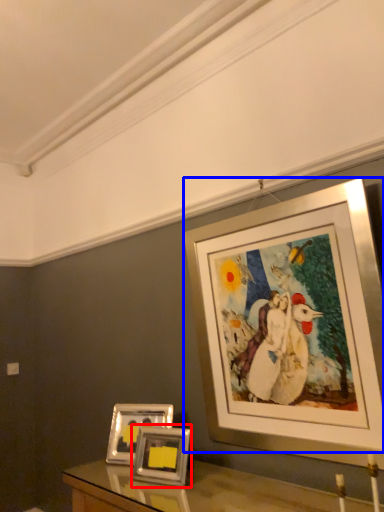
Question: Among these objects, which one is nearest to the camera, picture frame (highlighted by a red box) or picture frame (highlighted by a blue box)?

Choices:
 (A) picture frame
 (B) picture frame

Answer: (B)